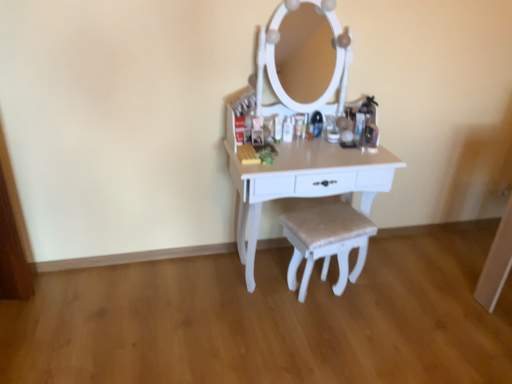
Where is `free space between beige fabric stool at center and white painted wood table at center`? This screenshot has width=512, height=384. free space between beige fabric stool at center and white painted wood table at center is located at coordinates (294, 308).